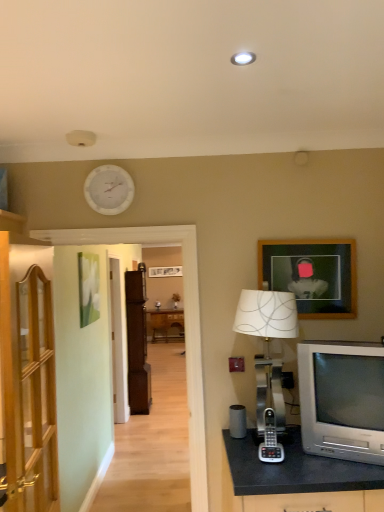
Measure the distance between wooden cabinet at left, which appears as the 2th cabinetry when viewed from the back, and camera.

The depth of wooden cabinet at left, which appears as the 2th cabinetry when viewed from the back, is 4.98 feet.

Identify the location of silver metallic phone at center. This screenshot has width=384, height=512. [x=270, y=440].

The height and width of the screenshot is (512, 384). What do you see at coordinates (109, 189) in the screenshot?
I see `white matte clock at upper center` at bounding box center [109, 189].

Find the location of `wooden picture frame at upper right`. wooden picture frame at upper right is located at coordinates (312, 275).

Is white matte clock at upper center not inside silver metallic television at lower right?

Yes, white matte clock at upper center is outside of silver metallic television at lower right.

This screenshot has height=512, width=384. Find the location of `clock above the silver metallic television at lower right (from the image's perspective)`. clock above the silver metallic television at lower right (from the image's perspective) is located at coordinates tap(109, 189).

From the image's perspective, is white matte clock at upper center located above silver metallic television at lower right?

Correct, white matte clock at upper center appears higher than silver metallic television at lower right in the image.

Is white matte clock at upper center oriented away from silver metallic television at lower right?

That's not correct — white matte clock at upper center is not looking away from silver metallic television at lower right.

Considering the relative sizes of silver metallic television at lower right and wooden picture frame at upper right in the image provided, is silver metallic television at lower right bigger than wooden picture frame at upper right?

Yes.

How far apart are silver metallic television at lower right and wooden picture frame at upper right?

silver metallic television at lower right and wooden picture frame at upper right are 20.87 inches apart from each other.

Image resolution: width=384 pixels, height=512 pixels. What are the coordinates of `television below the wooden picture frame at upper right (from a real-world perspective)` in the screenshot? It's located at (342, 400).

Considering the positions of objects silver metallic phone at center and brown wood cabinet at center, arranged as the second cabinetry when viewed from the front, in the image provided, who is in front, silver metallic phone at center or brown wood cabinet at center, arranged as the second cabinetry when viewed from the front,?

silver metallic phone at center is in front.

In the scene shown: From a real-world perspective, is silver metallic phone at center over brown wood cabinet at center, arranged as the second cabinetry when viewed from the front?

Yes, from a real-world perspective, silver metallic phone at center is over brown wood cabinet at center, arranged as the second cabinetry when viewed from the front

From the image's perspective, is silver metallic phone at center above or below brown wood cabinet at center, arranged as the second cabinetry when viewed from the front?

From the image's perspective, silver metallic phone at center appears above brown wood cabinet at center, arranged as the second cabinetry when viewed from the front.

Is silver metallic phone at center oriented towards brown wood cabinet at center, arranged as the second cabinetry when viewed from the front?

No, silver metallic phone at center is not turned towards brown wood cabinet at center, arranged as the second cabinetry when viewed from the front.

Between wooden picture frame at upper right and white matte clock at upper center, which one has larger size?

With larger size is wooden picture frame at upper right.

Is wooden picture frame at upper right taller than white matte clock at upper center?

Yes.

In the image, is wooden picture frame at upper right on the left side or the right side of white matte clock at upper center?

From the image, it's evident that wooden picture frame at upper right is to the right of white matte clock at upper center.

From a real-world perspective, is wooden picture frame at upper right positioned above or below white matte clock at upper center?

In terms of real-world spatial position, wooden picture frame at upper right is below white matte clock at upper center.

From a real-world perspective, is silver metallic table lamp at right on wooden picture frame at upper right?

Incorrect, from a real-world perspective, silver metallic table lamp at right is lower than wooden picture frame at upper right.

Considering the sizes of objects silver metallic table lamp at right and wooden picture frame at upper right in the image provided, who is bigger, silver metallic table lamp at right or wooden picture frame at upper right?

With larger size is silver metallic table lamp at right.

Considering the sizes of objects silver metallic table lamp at right and wooden picture frame at upper right in the image provided, who is thinner, silver metallic table lamp at right or wooden picture frame at upper right?

wooden picture frame at upper right is thinner.

Is brown wood cabinet at center, which is counted as the first cabinetry, starting from the back, located outside silver metallic phone at center?

Yes, brown wood cabinet at center, which is counted as the first cabinetry, starting from the back, is outside of silver metallic phone at center.

What's the angular difference between brown wood cabinet at center, which is counted as the first cabinetry, starting from the back, and silver metallic phone at center's facing directions?

The angular difference between brown wood cabinet at center, which is counted as the first cabinetry, starting from the back, and silver metallic phone at center is 105 degrees.

In terms of size, does brown wood cabinet at center, arranged as the second cabinetry when viewed from the front, appear bigger or smaller than silver metallic phone at center?

In the image, brown wood cabinet at center, arranged as the second cabinetry when viewed from the front, appears to be larger than silver metallic phone at center.

Locate an element on the screen. This screenshot has height=512, width=384. the 1st cabinetry counting from the left side of the silver metallic phone at center is located at coordinates (137, 342).

From a real-world perspective, is wooden cabinet at left, positioned as the 1th cabinetry in front-to-back order, located higher than silver metallic phone at center?

Yes.

Considering the sizes of wooden cabinet at left, positioned as the 1th cabinetry in front-to-back order, and silver metallic phone at center in the image, is wooden cabinet at left, positioned as the 1th cabinetry in front-to-back order, bigger or smaller than silver metallic phone at center?

wooden cabinet at left, positioned as the 1th cabinetry in front-to-back order, is bigger than silver metallic phone at center.

Consider the image. Between wooden cabinet at left, positioned as the 1th cabinetry in front-to-back order, and silver metallic phone at center, which one is positioned in front?

Positioned in front is wooden cabinet at left, positioned as the 1th cabinetry in front-to-back order.

Is wooden cabinet at left, which appears as the 2th cabinetry when viewed from the back, located outside silver metallic phone at center?

Yes.

I want to click on television below the white matte clock at upper center (from a real-world perspective), so click(x=342, y=400).

The width and height of the screenshot is (384, 512). I want to click on television below the wooden picture frame at upper right (from the image's perspective), so click(342, 400).

From the image, which object appears to be farther from brown wood cabinet at center, arranged as the second cabinetry when viewed from the front, wooden cabinet at left, positioned as the 1th cabinetry in front-to-back order, or silver metallic phone at center?

Based on the image, silver metallic phone at center appears to be further to brown wood cabinet at center, arranged as the second cabinetry when viewed from the front.

Estimate the real-world distances between objects in this image. Which object is closer to brown wood cabinet at center, which is counted as the first cabinetry, starting from the back, wooden picture frame at upper right or white matte clock at upper center?

Among the two, white matte clock at upper center is located nearer to brown wood cabinet at center, which is counted as the first cabinetry, starting from the back.

Considering their positions, is silver metallic television at lower right positioned further to silver metallic phone at center than wooden picture frame at upper right?

Among the two, wooden picture frame at upper right is located further to silver metallic phone at center.

Based on their spatial positions, is wooden picture frame at upper right or wooden cabinet at left, positioned as the 1th cabinetry in front-to-back order, closer to brown wood cabinet at center, arranged as the second cabinetry when viewed from the front?

wooden cabinet at left, positioned as the 1th cabinetry in front-to-back order, lies closer to brown wood cabinet at center, arranged as the second cabinetry when viewed from the front, than the other object.

Considering their positions, is silver metallic table lamp at right positioned closer to silver metallic phone at center than wooden picture frame at upper right?

silver metallic table lamp at right is closer to silver metallic phone at center.

Looking at the image, which one is located closer to brown wood cabinet at center, which is counted as the first cabinetry, starting from the back, white matte clock at upper center or wooden cabinet at left, positioned as the 1th cabinetry in front-to-back order?

white matte clock at upper center lies closer to brown wood cabinet at center, which is counted as the first cabinetry, starting from the back, than the other object.

Looking at this image, based on their spatial positions, is wooden cabinet at left, positioned as the 1th cabinetry in front-to-back order, or brown wood cabinet at center, arranged as the second cabinetry when viewed from the front, further from silver metallic phone at center?

brown wood cabinet at center, arranged as the second cabinetry when viewed from the front, lies further to silver metallic phone at center than the other object.

Which object lies further to the anchor point silver metallic table lamp at right, wooden cabinet at left, which appears as the 2th cabinetry when viewed from the back, or brown wood cabinet at center, which is counted as the first cabinetry, starting from the back?

brown wood cabinet at center, which is counted as the first cabinetry, starting from the back, is further to silver metallic table lamp at right.

The width and height of the screenshot is (384, 512). Identify the location of clock between wooden cabinet at left, positioned as the 1th cabinetry in front-to-back order, and silver metallic table lamp at right, in the horizontal direction. (109, 189).

Find the location of `table lamp located between silver metallic phone at center and silver metallic television at lower right in the left-right direction`. table lamp located between silver metallic phone at center and silver metallic television at lower right in the left-right direction is located at coordinates (268, 344).

You are a GUI agent. You are given a task and a screenshot of the screen. Output one action in this format:
    pyautogui.click(x=<x>, y=<y>)
    Task: Click on the clock between silver metallic table lamp at right and brown wood cabinet at center, arranged as the second cabinetry when viewed from the front, in the front-back direction
    This screenshot has height=512, width=384.
    Given the screenshot: What is the action you would take?
    pyautogui.click(x=109, y=189)

The width and height of the screenshot is (384, 512). I want to click on clock between silver metallic television at lower right and brown wood cabinet at center, which is counted as the first cabinetry, starting from the back, from front to back, so click(x=109, y=189).